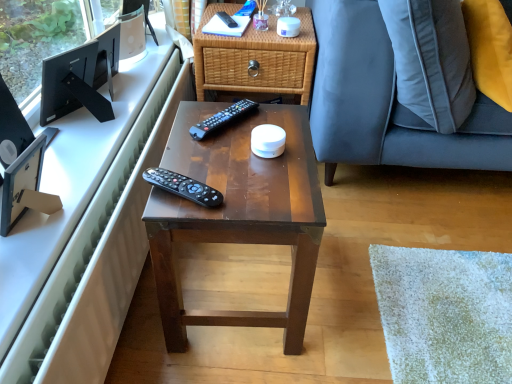
Where is `vacant region to the left of black plastic remote control at center, which ranks as the second remote control in top-to-bottom order`? vacant region to the left of black plastic remote control at center, which ranks as the second remote control in top-to-bottom order is located at coordinates (190, 121).